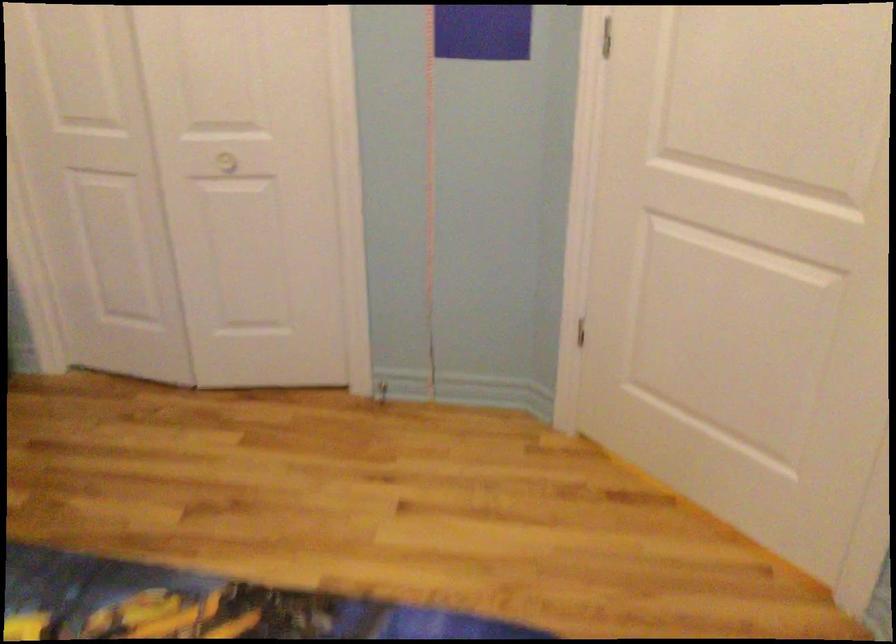
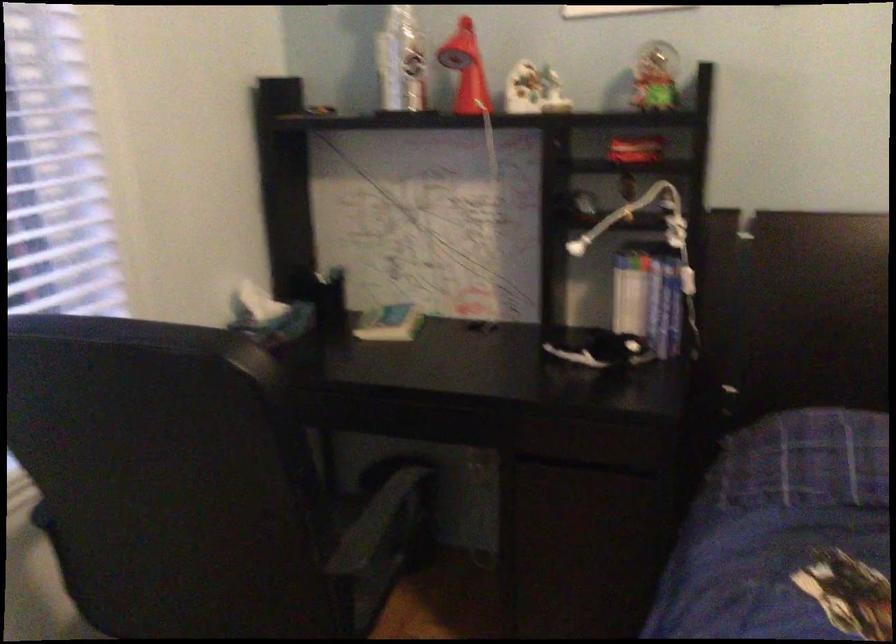
The images are taken continuously from a first-person perspective. In which direction is your viewpoint rotating?

The camera's rotation is toward left-down.